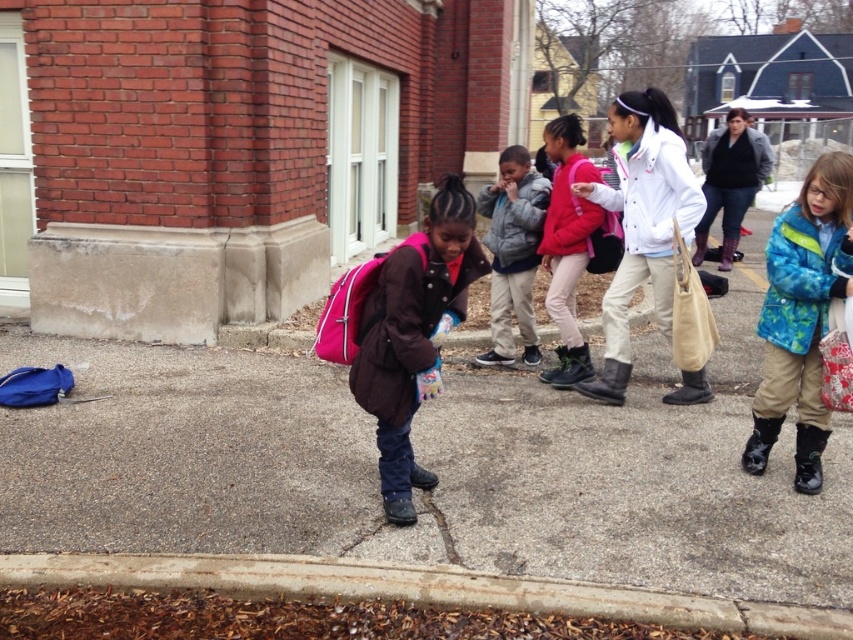
Is pink fabric backpack at center smaller than gray fleece jacket at center?

No.

Between point (403, 355) and point (521, 211), which one is positioned behind?

Point (521, 211)

The image size is (853, 640). Identify the location of pink fabric backpack at center. (412, 333).

Between concrete at lower left and white matte jacket at center, which one is positioned higher?

white matte jacket at center is above.

Is concrete at lower left above white matte jacket at center?

No, concrete at lower left is not above white matte jacket at center.

This screenshot has width=853, height=640. Find the location of `concrete at lower left`. concrete at lower left is located at coordinates (416, 588).

Measure the distance from concrete at lower left to gray fleece jacket at center.

concrete at lower left and gray fleece jacket at center are 3.06 meters apart from each other.

Does point (96, 561) come behind point (494, 189)?

No, (96, 561) is closer to viewer.

Identify the location of concrete at lower left. (416, 588).